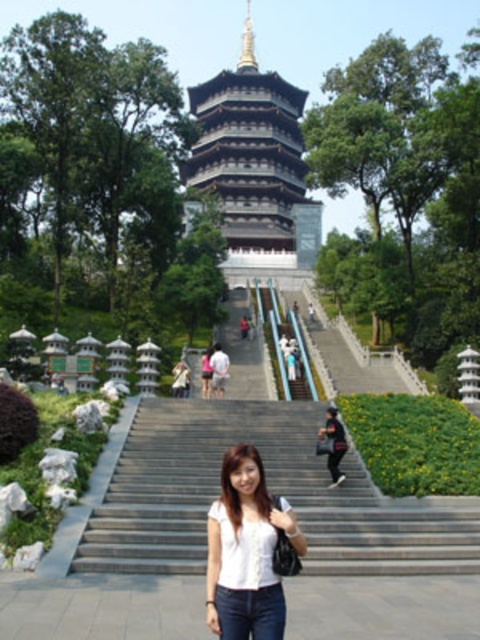
Can you confirm if white stone pagoda at center is positioned below white matte shirt at center?

Incorrect, white stone pagoda at center is not positioned below white matte shirt at center.

Between point (232, 100) and point (257, 573), which one is positioned in front?

Point (257, 573)

Where is `white stone pagoda at center`? This screenshot has height=640, width=480. white stone pagoda at center is located at coordinates (254, 166).

Can you confirm if gray concrete stairs at center is shorter than white matte shirt at center?

Incorrect, gray concrete stairs at center's height does not fall short of white matte shirt at center's.

In the scene shown: Is gray concrete stairs at center positioned behind white matte shirt at center?

That is True.

The width and height of the screenshot is (480, 640). I want to click on gray concrete stairs at center, so click(x=269, y=490).

Where is `gray concrete stairs at center`? This screenshot has height=640, width=480. gray concrete stairs at center is located at coordinates (269, 490).

Based on the photo, does white matte shirt at center appear on the right side of matte black shirt at center?

Incorrect, white matte shirt at center is not on the right side of matte black shirt at center.

Does white matte shirt at center appear on the left side of matte black shirt at center?

Correct, you'll find white matte shirt at center to the left of matte black shirt at center.

Does point (244, 448) come behind point (327, 451)?

No.

What are the coordinates of `white matte shirt at center` in the screenshot? It's located at (249, 552).